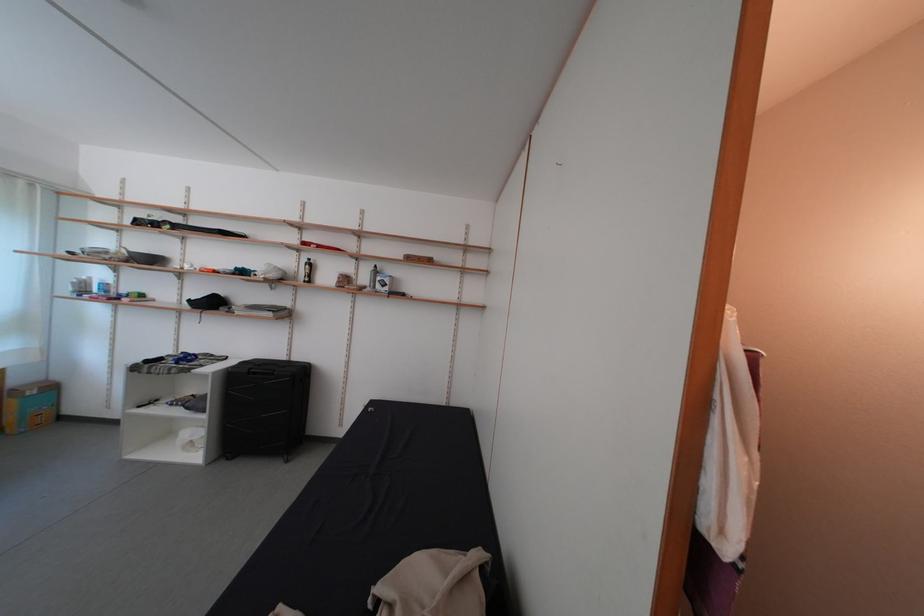
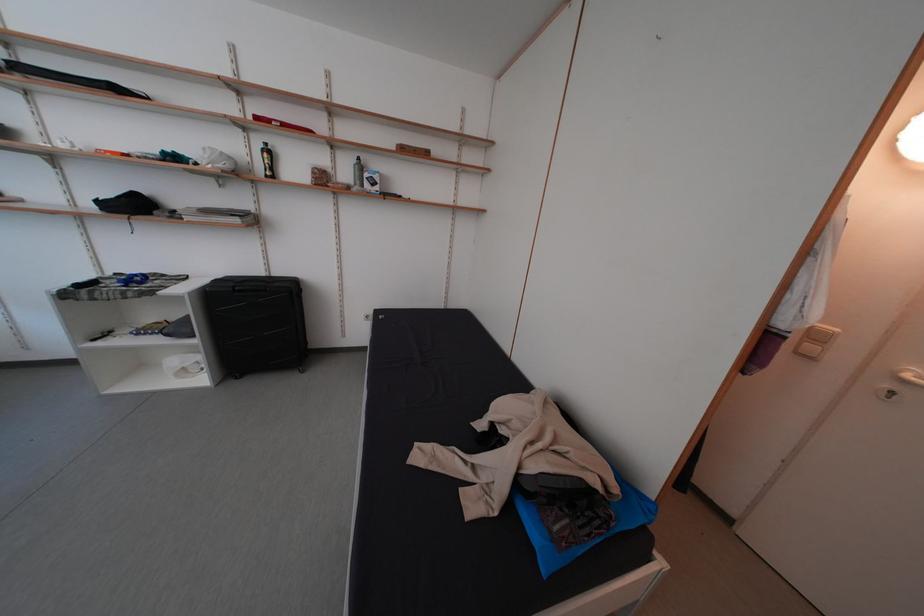
Where in the second image is the point corresponding to [372,284] from the first image?

(354, 179)